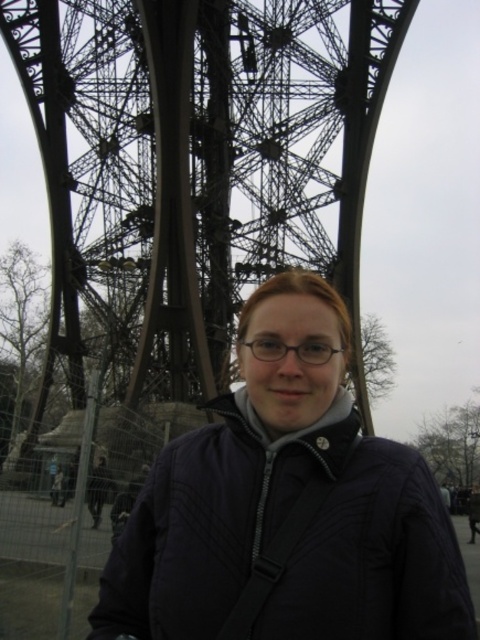
Can you confirm if metallic structure at center is thinner than matte black jacket at center?

No.

Is point (186, 132) in front of point (334, 438)?

That is False.

This screenshot has width=480, height=640. Find the location of `metallic structure at center`. metallic structure at center is located at coordinates (195, 168).